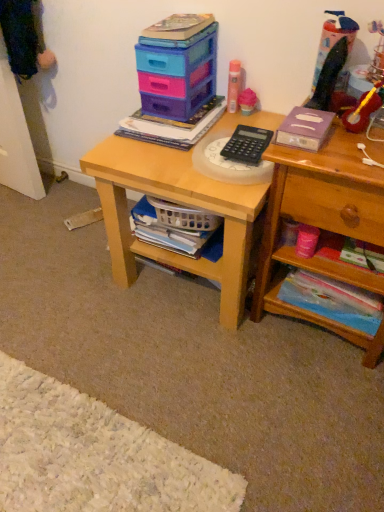
Image resolution: width=384 pixels, height=512 pixels. I want to click on free space in front of pink matte ice cream cone at upper center, placed as the 3th toy when sorted from right to left, so click(233, 124).